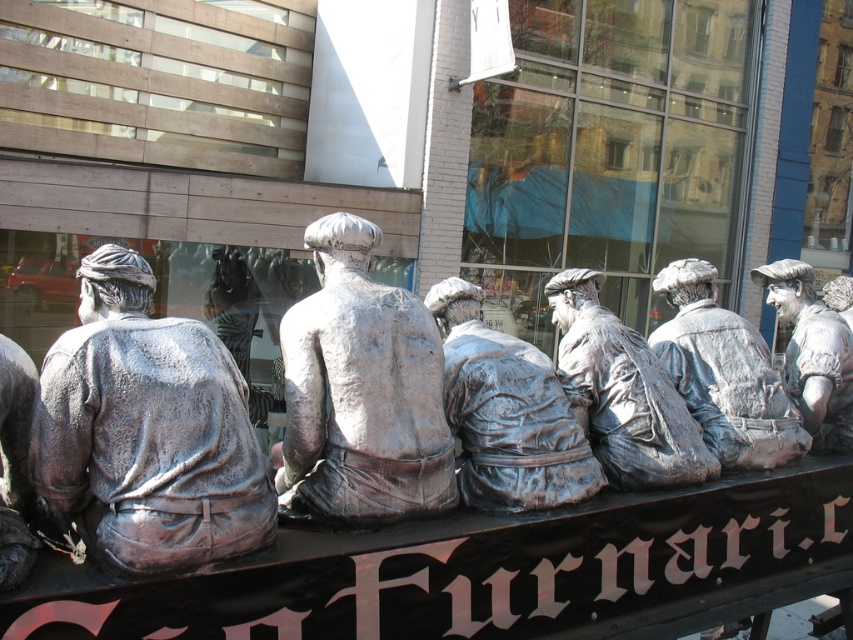
You are a photographer standing at the camera position. You want to take a closeup photo of the shiny silver statue at left. Can you reach it without moving your feet?

The shiny silver statue at left is 8.26 feet away from camera, so yes, you can reach it without moving your feet since it is within a comfortable distance for a photographer to capture a closeup.

You are an architect assessing the proportions of the scene. Given the clear glass window at center and the bronze statue at center, which one has a greater height?

The clear glass window at center is taller than the bronze statue at center according to the description.

What is the 2D coordinate of the clear glass window at center?

The clear glass window at center is located at the 2D coordinate point of (605,152).